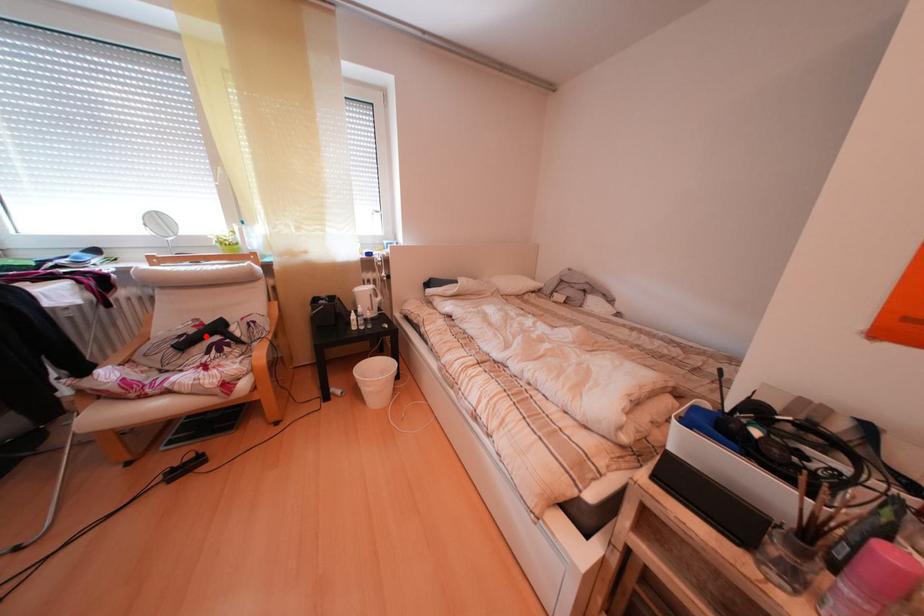
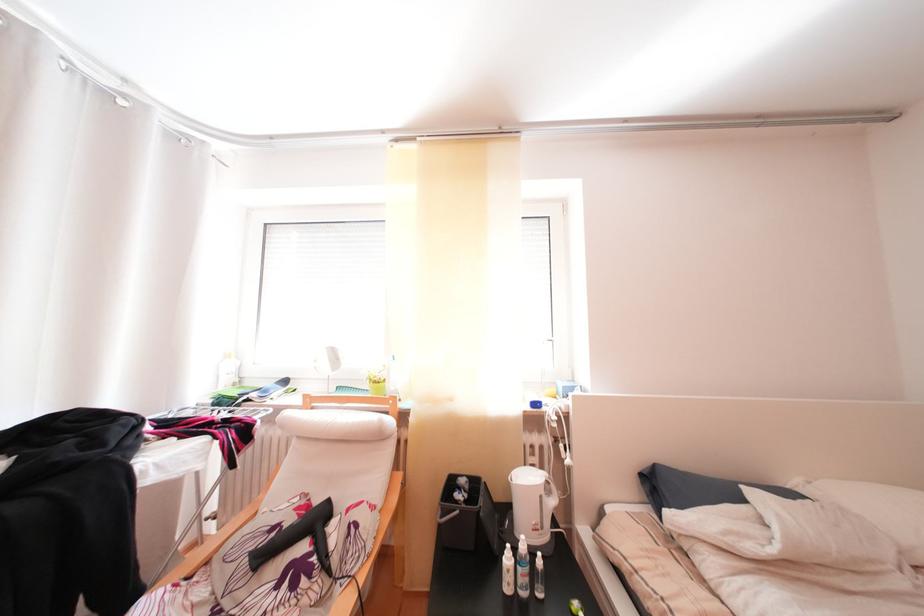
Locate, in the second image, the point that corresponds to the highlighted location in the first image.

(301, 525)